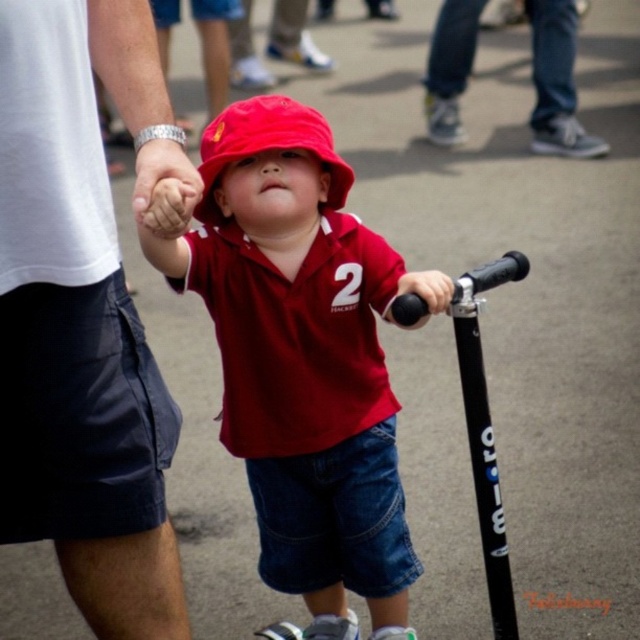
Is denim jeans at lower right taller than matte skin hand at center?

Yes.

Is denim jeans at lower right above matte skin hand at center?

Yes, denim jeans at lower right is above matte skin hand at center.

Locate an element on the screen. denim jeans at lower right is located at coordinates (556, 83).

Locate an element on the screen. The width and height of the screenshot is (640, 640). denim jeans at lower right is located at coordinates tap(556, 83).

Which is more to the left, matte red shirt at center or matte skin hand at center?

matte skin hand at center

Does point (200, 220) come behind point (172, 144)?

Yes, it is behind point (172, 144).

The width and height of the screenshot is (640, 640). What are the coordinates of `matte red shirt at center` in the screenshot? It's located at (298, 353).

At what (x,y) coordinates should I click in order to perform the action: click on matte red shirt at center. Please return your answer as a coordinate pair (x, y). The width and height of the screenshot is (640, 640). Looking at the image, I should click on (298, 353).

Between point (170, 145) and point (420, 316), which one is positioned behind?

Point (420, 316)

Is matte skin hand at center thinner than black rubber handlebar at center?

No, matte skin hand at center is not thinner than black rubber handlebar at center.

The height and width of the screenshot is (640, 640). In order to click on matte skin hand at center in this screenshot , I will do `click(163, 173)`.